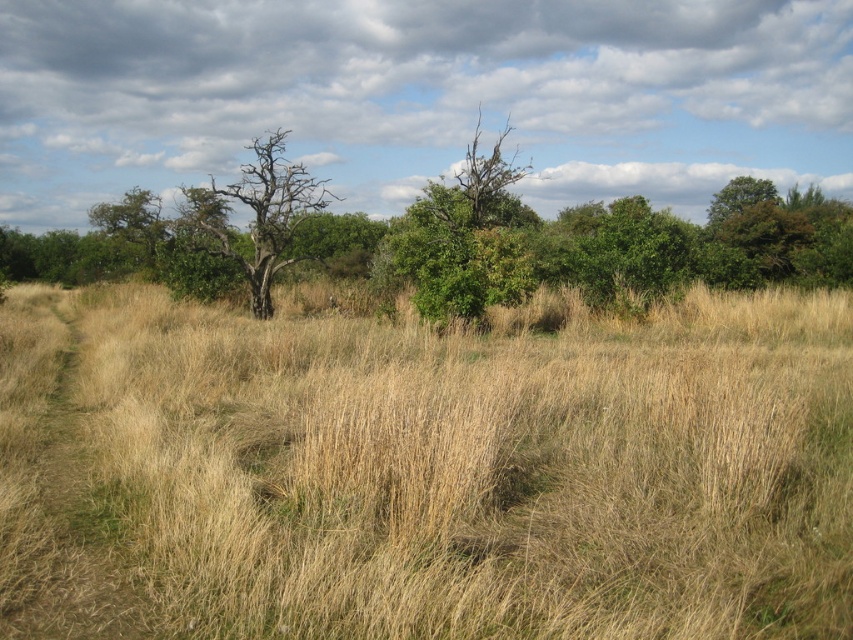
Question: Which point is farther from the camera taking this photo?

Choices:
 (A) pyautogui.click(x=462, y=227)
 (B) pyautogui.click(x=264, y=291)

Answer: (B)

Question: Which object is positioned closest to the bare wood tree at center?

Choices:
 (A) green leafy tree at center
 (B) dry grass at center

Answer: (A)

Question: Is dry grass at center to the right of bare wood tree at center from the viewer's perspective?

Choices:
 (A) no
 (B) yes

Answer: (B)

Question: Which object is closer to the camera taking this photo?

Choices:
 (A) dry grass at center
 (B) bare wood tree at center

Answer: (A)

Question: Does green leafy tree at center appear over bare wood tree at center?

Choices:
 (A) yes
 (B) no

Answer: (A)

Question: Is dry grass at center wider than green leafy tree at center?

Choices:
 (A) no
 (B) yes

Answer: (A)